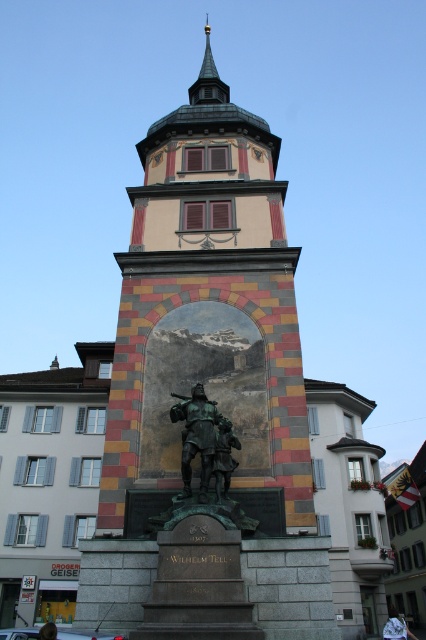
Question: Is multicolored stone tower at center bigger than gold spire at upper center?

Choices:
 (A) no
 (B) yes

Answer: (A)

Question: Can you confirm if multicolored stone tower at center is positioned to the right of bronze statue at center?

Choices:
 (A) yes
 (B) no

Answer: (B)

Question: Is bronze statue at center in front of gold spire at upper center?

Choices:
 (A) yes
 (B) no

Answer: (A)

Question: Which of these objects is positioned farthest from the multicolored stone tower at center?

Choices:
 (A) bronze statue at center
 (B) gold spire at upper center

Answer: (B)

Question: Which object appears farthest from the camera in this image?

Choices:
 (A) multicolored stone tower at center
 (B) bronze statue at center

Answer: (B)

Question: Which of the following is the closest to the observer?

Choices:
 (A) multicolored stone tower at center
 (B) gold spire at upper center

Answer: (A)